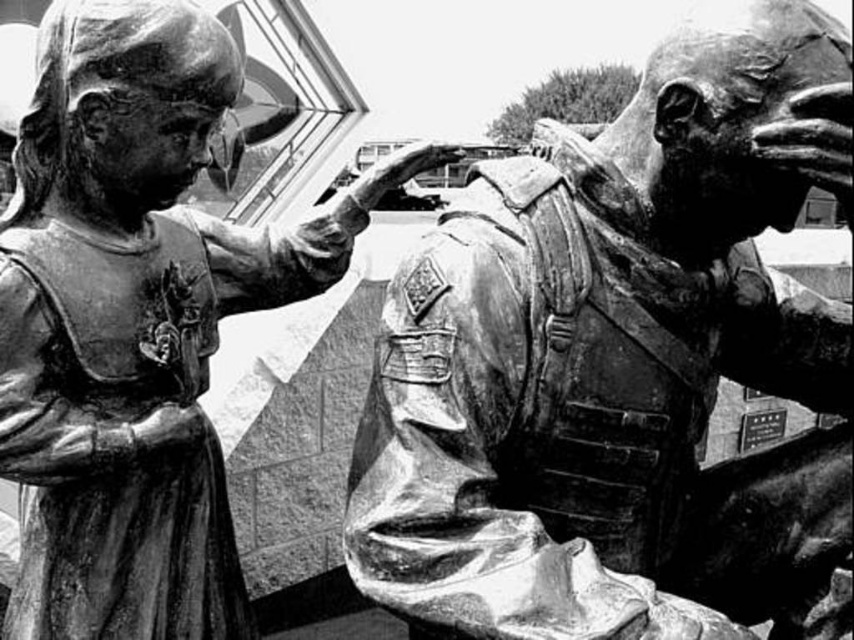
You are a photographer standing at the camera position. You want to take a closeup shot of the bronze soldier at center. Considering your current position, can you move closer to get a better shot without exceeding the 10 feet safety distance rule?

The bronze soldier at center is 9.32 feet away from camera. Since the safety distance is 10 feet, you can move closer to take the closeup shot as you are currently within the allowed distance.

You are an art historian analyzing the sculpture. You notice a specific point at coordinates (616,365). What does this point correspond to in the sculpture?

The point at coordinates (616,365) corresponds to the bronze soldier at center.